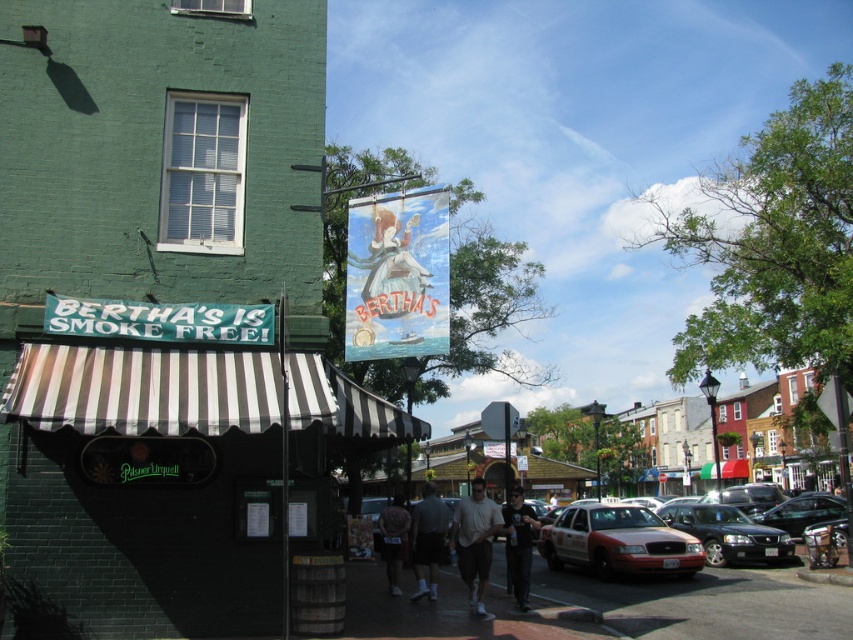
Is point (677, 592) farther from camera compared to point (412, 541)?

Yes, point (677, 592) is farther from viewer.

What are the coordinates of `smooth asphalt road at center` in the screenshot? It's located at (699, 604).

Which is behind, point (749, 572) or point (421, 541)?

The point (749, 572) is behind.

This screenshot has width=853, height=640. Find the location of `smooth asphalt road at center`. smooth asphalt road at center is located at coordinates (699, 604).

Is metallic red taxi at center bigger than dark gray t-shirt at center?

Yes.

Find the location of a particular element. metallic red taxi at center is located at coordinates (618, 541).

Between metallic red taxi at center and gray fabric shorts at center, which one has less height?

metallic red taxi at center is shorter.

Which is in front, point (596, 536) or point (437, 532)?

Point (437, 532) is in front.

The image size is (853, 640). What are the coordinates of `metallic red taxi at center` in the screenshot? It's located at (618, 541).